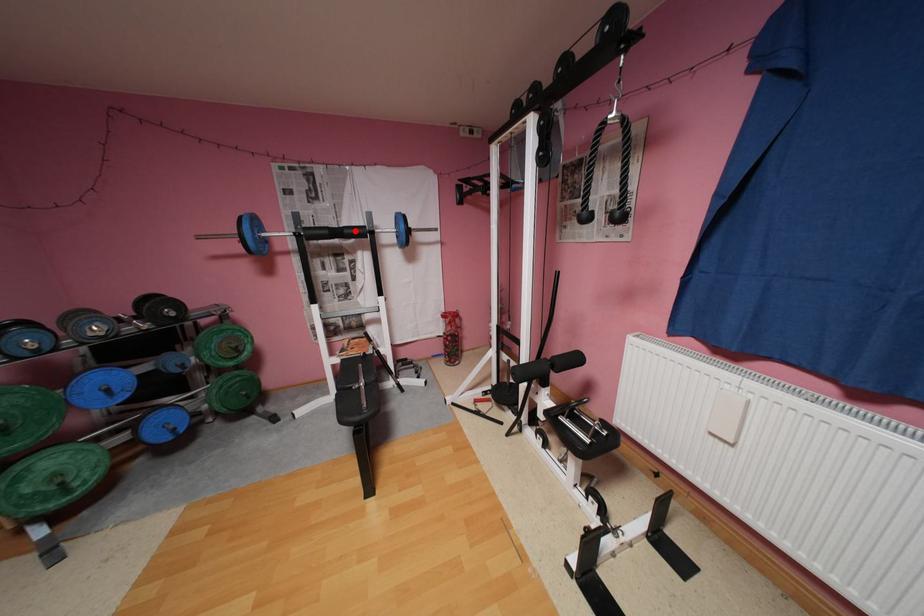
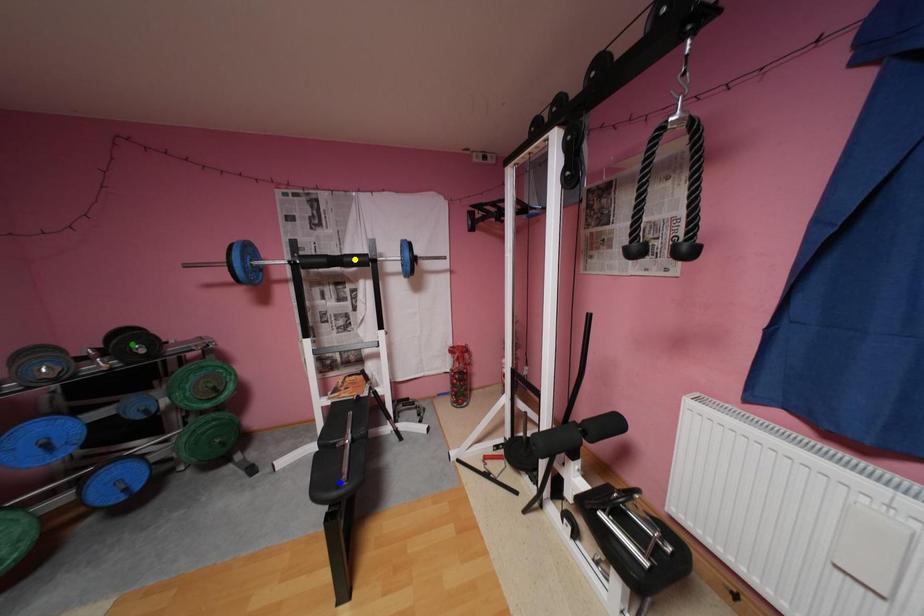
Question: I am providing you with two images of the same scene from different viewpoints. A red point is marked on the first image. You are given multiple points on the second image. Can you choose the point in image 2 that corresponds to the point in image 1?

Choices:
 (A) green point
 (B) blue point
 (C) yellow point

Answer: (C)